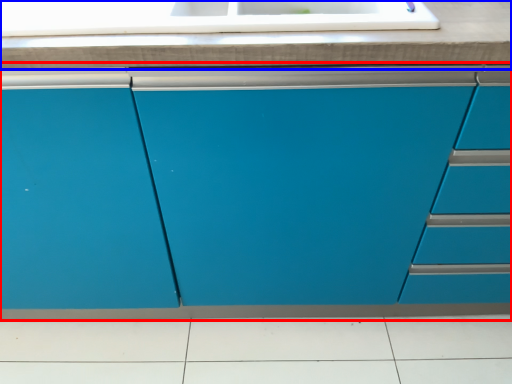
Question: Which point is closer to the camera, cabinetry (highlighted by a red box) or countertop (highlighted by a blue box)?

Choices:
 (A) cabinetry
 (B) countertop

Answer: (A)